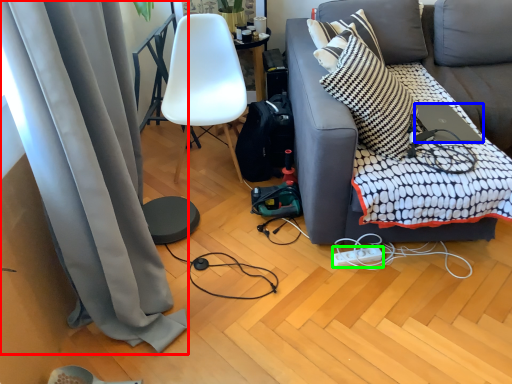
Question: Estimate the real-world distances between objects in this image. Which object is closer to curtain (highlighted by a red box), laptop (highlighted by a blue box) or power outlet (highlighted by a green box)?

Choices:
 (A) laptop
 (B) power outlet

Answer: (B)